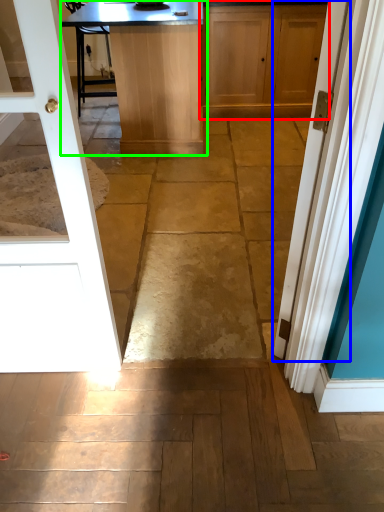
Question: Which object is the farthest from cabinetry (highlighted by a red box)? Choose among these: door (highlighted by a blue box) or table (highlighted by a green box).

Choices:
 (A) door
 (B) table

Answer: (A)